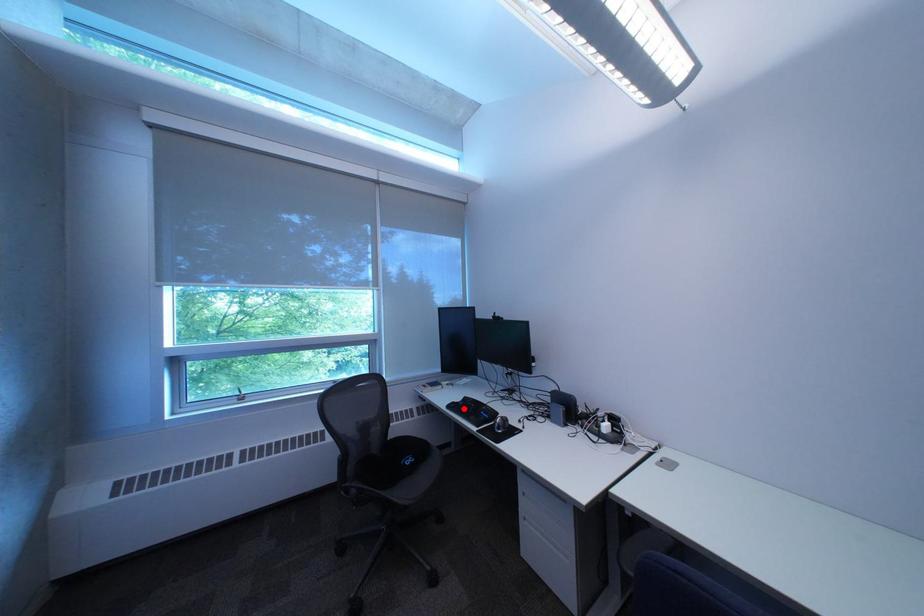
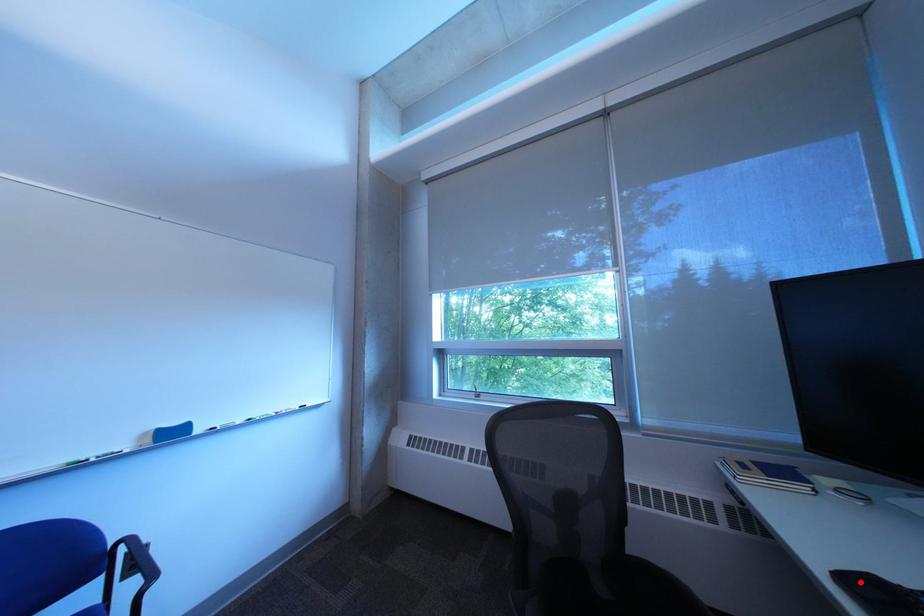
I am providing you with two images of the same scene from different viewpoints. A red point is marked on the first image and another point is marked on the second image. Is the red point in image1 aligned with the point shown in image2?

Yes